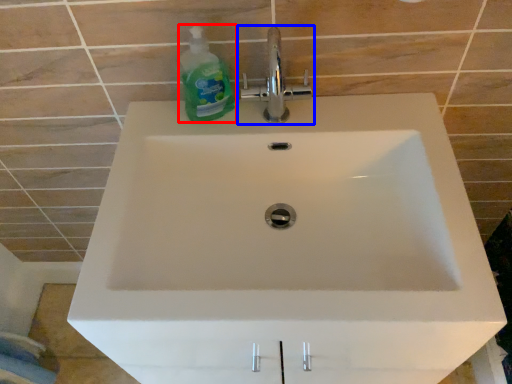
Question: Which point is closer to the camera, cleaning product (highlighted by a red box) or tap (highlighted by a blue box)?

Choices:
 (A) cleaning product
 (B) tap

Answer: (A)